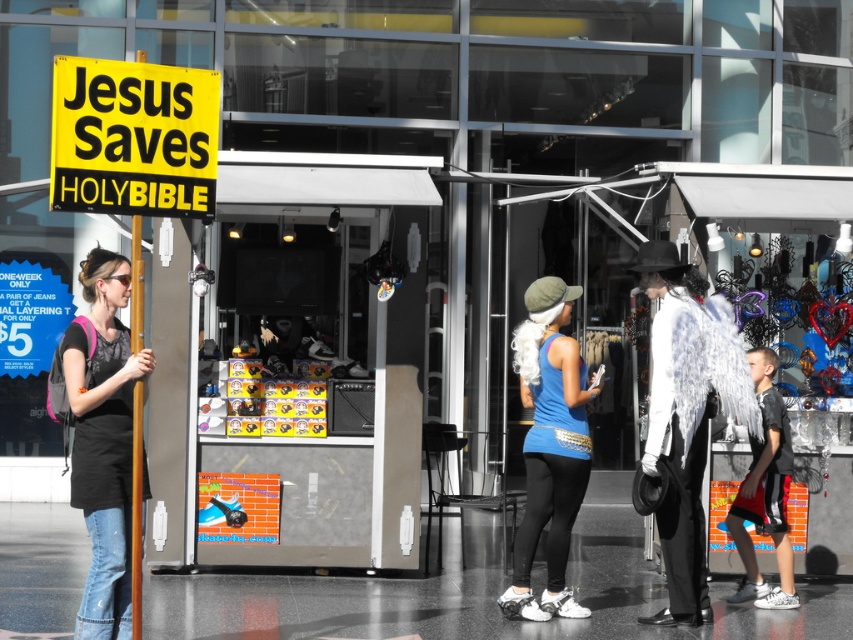
Which is above, matte black t-shirt at left or black mesh shirt at right?

Positioned higher is matte black t-shirt at left.

Is point (113, 524) in front of point (746, 541)?

Yes.

Identify the location of matte black t-shirt at left. The image size is (853, 640). (103, 442).

Who is positioned more to the left, blue fabric tank top at center or black mesh shirt at right?

Positioned to the left is blue fabric tank top at center.

Does point (517, 592) come behind point (759, 404)?

No, it is in front of (759, 404).

I want to click on blue fabric tank top at center, so click(x=549, y=448).

Which is more to the right, matte black t-shirt at left or blue fabric tank top at center?

From the viewer's perspective, blue fabric tank top at center appears more on the right side.

Is matte black t-shirt at left in front of blue fabric tank top at center?

Yes, it is.

This screenshot has height=640, width=853. I want to click on matte black t-shirt at left, so click(x=103, y=442).